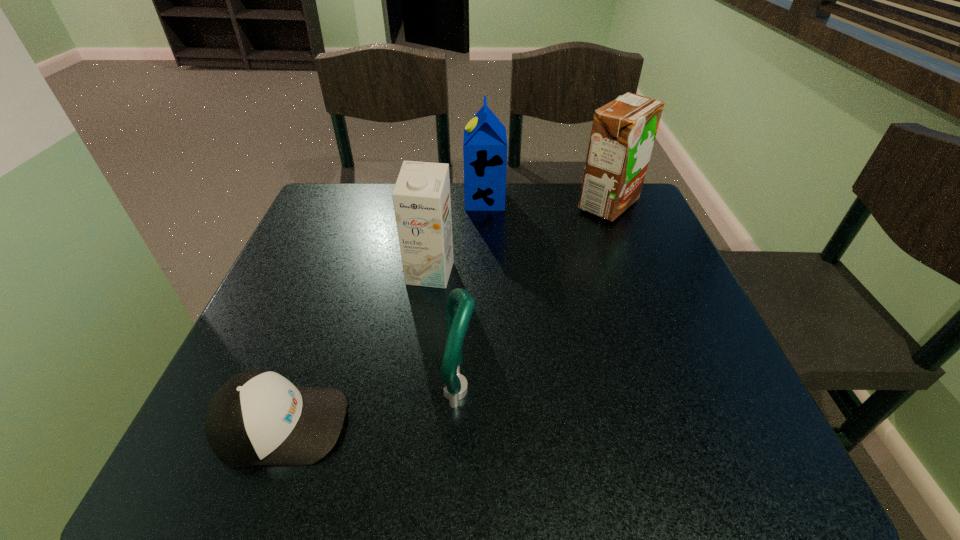
The image size is (960, 540). I want to click on object that is positioned at the near left corner, so click(x=258, y=417).

You are a GUI agent. You are given a task and a screenshot of the screen. Output one action in this format:
    pyautogui.click(x=<x>, y=<y>)
    Task: Click on the object at the far right corner
    
    Given the screenshot: What is the action you would take?
    pyautogui.click(x=623, y=132)

The width and height of the screenshot is (960, 540). In order to click on free space at the far edge of the desktop in this screenshot , I will do `click(501, 221)`.

Locate an element on the screen. This screenshot has width=960, height=540. vacant space at the near edge of the desktop is located at coordinates (356, 452).

In the image, there is a desktop. Identify the location of vacant space at the left edge. (317, 284).

Image resolution: width=960 pixels, height=540 pixels. In the image, there is a desktop. What are the coordinates of `free region at the right edge` in the screenshot? It's located at (675, 334).

Image resolution: width=960 pixels, height=540 pixels. I want to click on free space at the far left corner, so click(x=337, y=194).

The width and height of the screenshot is (960, 540). I want to click on vacant region at the far right corner of the desktop, so click(605, 222).

In the image, there is a desktop. Identify the location of vacant space at the near right corner. (733, 471).

Image resolution: width=960 pixels, height=540 pixels. Identify the location of empty space that is in between the second carton from right to left and the cap. (383, 312).